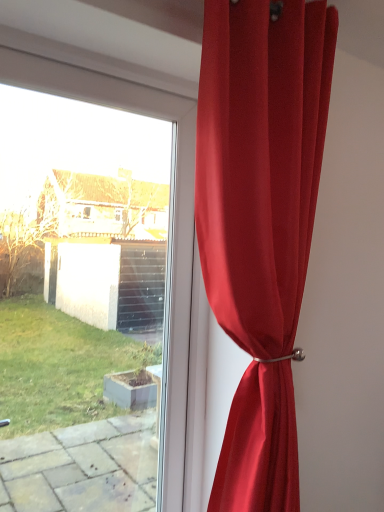
Question: Is satin red curtain at right with transparent glass window at upper left?

Choices:
 (A) no
 (B) yes

Answer: (A)

Question: Does satin red curtain at right have a lesser height compared to transparent glass window at upper left?

Choices:
 (A) yes
 (B) no

Answer: (B)

Question: Could transparent glass window at upper left be considered to be inside satin red curtain at right?

Choices:
 (A) no
 (B) yes

Answer: (A)

Question: Is satin red curtain at right at the left side of transparent glass window at upper left?

Choices:
 (A) yes
 (B) no

Answer: (B)

Question: From a real-world perspective, does satin red curtain at right sit lower than transparent glass window at upper left?

Choices:
 (A) yes
 (B) no

Answer: (B)

Question: From the image's perspective, is satin red curtain at right below transparent glass window at upper left?

Choices:
 (A) yes
 (B) no

Answer: (B)

Question: Could you tell me if transparent glass window at upper left is turned towards satin red curtain at right?

Choices:
 (A) no
 (B) yes

Answer: (B)

Question: Does transparent glass window at upper left appear on the left side of satin red curtain at right?

Choices:
 (A) no
 (B) yes

Answer: (B)

Question: From a real-world perspective, is transparent glass window at upper left positioned over satin red curtain at right based on gravity?

Choices:
 (A) no
 (B) yes

Answer: (A)

Question: From the image's perspective, is transparent glass window at upper left beneath satin red curtain at right?

Choices:
 (A) yes
 (B) no

Answer: (A)

Question: From the image's perspective, is transparent glass window at upper left above satin red curtain at right?

Choices:
 (A) no
 (B) yes

Answer: (A)

Question: Is transparent glass window at upper left not near satin red curtain at right?

Choices:
 (A) yes
 (B) no

Answer: (B)

Question: Would you say satin red curtain at right is to the left or to the right of transparent glass window at upper left in the picture?

Choices:
 (A) right
 (B) left

Answer: (A)